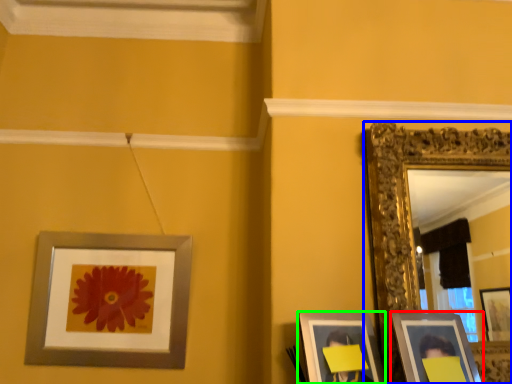
Question: Which object is the closest to the picture frame (highlighted by a red box)? Choose among these: picture frame (highlighted by a blue box) or picture frame (highlighted by a green box).

Choices:
 (A) picture frame
 (B) picture frame

Answer: (B)